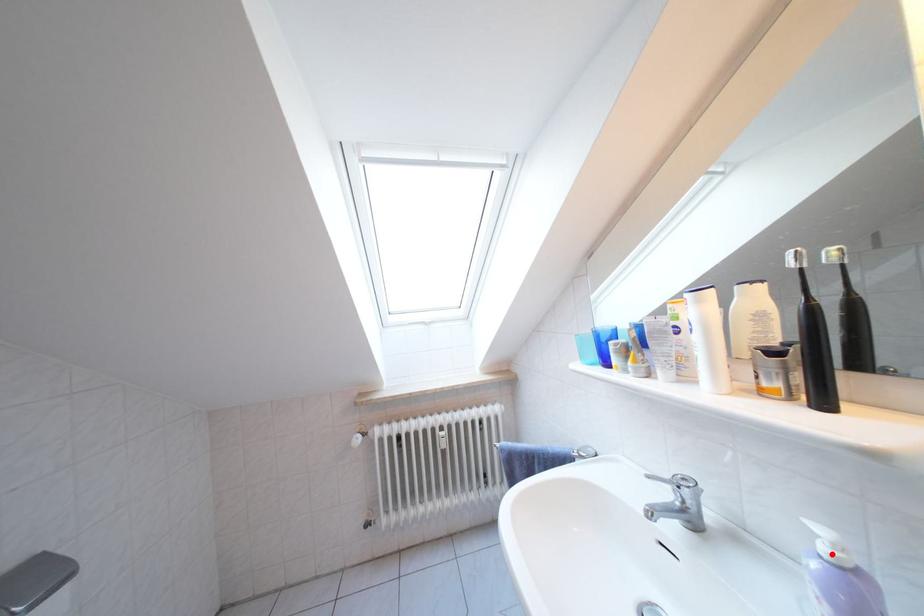
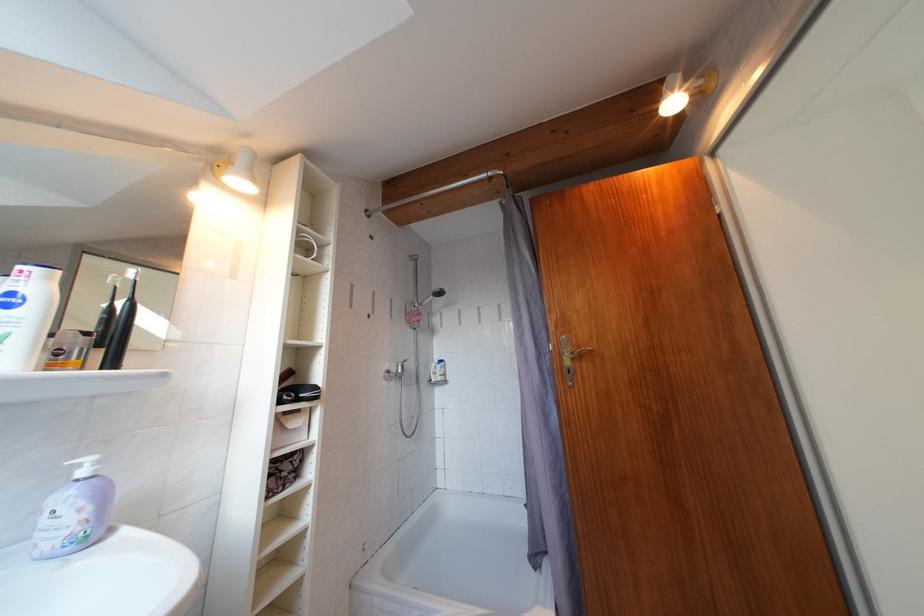
The point at the highlighted location is marked in the first image. Where is the corresponding point in the second image?

(92, 477)